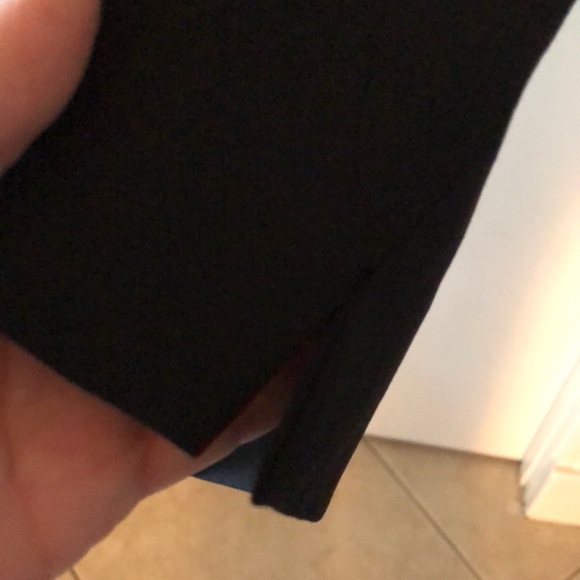
The width and height of the screenshot is (580, 580). What are the coordinates of `wall` in the screenshot? It's located at (577, 456).